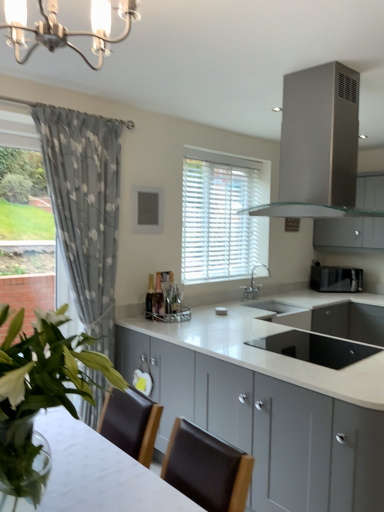
Locate an element on the screen. black matte toaster at right, which is the 1th appliance from back to front is located at coordinates (335, 278).

Locate an element on the screen. Image resolution: width=384 pixels, height=512 pixels. silver metallic faucet at center is located at coordinates (253, 285).

What do you see at coordinates (318, 145) in the screenshot? I see `stainless steel range hood at upper center` at bounding box center [318, 145].

Where is `black matte toaster at right, the second appliance positioned from the left`? This screenshot has height=512, width=384. black matte toaster at right, the second appliance positioned from the left is located at coordinates (335, 278).

From a real-world perspective, is white glossy cabinets at center, which is the 2th cabinetry from top to bottom, above or below brown leather chair at lower center?

white glossy cabinets at center, which is the 2th cabinetry from top to bottom, is situated lower than brown leather chair at lower center in the real world.

Which object is closer to the camera, white glossy cabinets at center, which is the second cabinetry in back-to-front order, or brown leather chair at lower center?

brown leather chair at lower center.

What's the angular difference between white glossy cabinets at center, which is the second cabinetry in back-to-front order, and brown leather chair at lower center's facing directions?

They differ by 177 degrees in their facing directions.

From the picture: Can you confirm if white glossy cabinets at center, which is the second cabinetry in back-to-front order, is thinner than brown leather chair at lower center?

No.

From the image's perspective, who appears lower, white blinds at center or white glossy cabinets at center, which appears as the 2th cabinetry when viewed from the right?

From the image's view, white glossy cabinets at center, which appears as the 2th cabinetry when viewed from the right, is below.

Is white blinds at center oriented towards white glossy cabinets at center, which appears as the 2th cabinetry when viewed from the right?

No.

How different are the orientations of white blinds at center and white glossy cabinets at center, which is the 2th cabinetry from top to bottom, in degrees?

They differ by 90.5 degrees in their facing directions.

From the picture: Is white glossy cabinets at center, which is the second cabinetry in back-to-front order, positioned far away from stainless steel range hood at upper center?

Indeed, white glossy cabinets at center, which is the second cabinetry in back-to-front order, is not near stainless steel range hood at upper center.

Could you tell me if white glossy cabinets at center, which appears as the 2th cabinetry when viewed from the right, is facing stainless steel range hood at upper center?

No, white glossy cabinets at center, which appears as the 2th cabinetry when viewed from the right, does not turn towards stainless steel range hood at upper center.

From the image's perspective, between black matte toaster at right, which is the second appliance in front-to-back order, and green leafy plant at center, which one is located above?

black matte toaster at right, which is the second appliance in front-to-back order, is shown above in the image.

Based on the photo, are black matte toaster at right, the first appliance positioned from the top, and green leafy plant at center making contact?

black matte toaster at right, the first appliance positioned from the top, and green leafy plant at center are not in contact.

From a real-world perspective, between black matte toaster at right, the first appliance positioned from the top, and green leafy plant at center, who is vertically lower?

In real-world perspective, black matte toaster at right, the first appliance positioned from the top, is lower.

Who is bigger, black matte toaster at right, the second appliance positioned from the left, or green leafy plant at center?

green leafy plant at center.

Is metallic chandelier at upper center with green leafy plant at center?

No, metallic chandelier at upper center is not with green leafy plant at center.

Between point (25, 29) and point (49, 353), which one is positioned in front?

The point (25, 29) is more forward.

Image resolution: width=384 pixels, height=512 pixels. I want to click on light fixture to the right of green leafy plant at center, so click(65, 27).

Is metallic chandelier at upper center bigger than green leafy plant at center?

No, metallic chandelier at upper center is not bigger than green leafy plant at center.

Considering the sizes of objects satin silver cabinet at upper right, which is the 1th cabinetry in back-to-front order, and metallic chandelier at upper center in the image provided, who is wider, satin silver cabinet at upper right, which is the 1th cabinetry in back-to-front order, or metallic chandelier at upper center?

With larger width is metallic chandelier at upper center.

Are satin silver cabinet at upper right, the second cabinetry positioned from the left, and metallic chandelier at upper center located far from each other?

satin silver cabinet at upper right, the second cabinetry positioned from the left, is positioned a significant distance from metallic chandelier at upper center.

Which of these two, satin silver cabinet at upper right, the second cabinetry positioned from the left, or metallic chandelier at upper center, is smaller?

Smaller between the two is metallic chandelier at upper center.

Could you tell me if satin silver cabinet at upper right, the 2th cabinetry when ordered from front to back, is turned towards metallic chandelier at upper center?

Yes, satin silver cabinet at upper right, the 2th cabinetry when ordered from front to back, is oriented towards metallic chandelier at upper center.

Considering the relative positions of gray floral fabric curtain at left and black matte toaster at right, which is the 1th appliance from back to front, in the image provided, is gray floral fabric curtain at left to the right of black matte toaster at right, which is the 1th appliance from back to front, from the viewer's perspective?

Incorrect, gray floral fabric curtain at left is not on the right side of black matte toaster at right, which is the 1th appliance from back to front.

Considering the relative positions of gray floral fabric curtain at left and black matte toaster at right, the 2th appliance positioned from the bottom, in the image provided, is gray floral fabric curtain at left behind black matte toaster at right, the 2th appliance positioned from the bottom,?

No, gray floral fabric curtain at left is closer to the viewer.

Is point (66, 240) less distant than point (345, 278)?

Yes.

From the image's perspective, does gray floral fabric curtain at left appear lower than black matte toaster at right, the second appliance positioned from the left?

No, from the image's perspective, gray floral fabric curtain at left is not beneath black matte toaster at right, the second appliance positioned from the left.

At what (x,y) coordinates should I click in order to perform the action: click on chair above the white glossy cabinets at center, which appears as the 2th cabinetry when viewed from the right (from the image's perspective). Please return your answer as a coordinate pair (x, y). Image resolution: width=384 pixels, height=512 pixels. Looking at the image, I should click on (206, 468).

Identify the location of cabinetry in front of the white blinds at center. This screenshot has width=384, height=512. (279, 393).

Looking at this image, from the image, which object appears to be nearer to black glass sink at center, the second appliance in the top-to-bottom sequence, black matte toaster at right, the 2th appliance positioned from the bottom, or white blinds at center?

white blinds at center is positioned closer to the anchor black glass sink at center, the second appliance in the top-to-bottom sequence.

Based on their spatial positions, is gray floral fabric curtain at left or black glass sink at center, placed as the second appliance when sorted from back to front, closer to green leafy plant at center?

black glass sink at center, placed as the second appliance when sorted from back to front, is positioned closer to the anchor green leafy plant at center.

From the image, which object appears to be farther from silver metallic faucet at center, satin silver cabinet at upper right, the second cabinetry positioned from the left, or metallic chandelier at upper center?

Among the two, metallic chandelier at upper center is located further to silver metallic faucet at center.

Estimate the real-world distances between objects in this image. Which object is closer to metallic chandelier at upper center, green leafy plant at center or white glossy cabinets at center, which appears as the 2th cabinetry when viewed from the right?

The object closer to metallic chandelier at upper center is green leafy plant at center.

Based on their spatial positions, is black matte toaster at right, which is the second appliance in front-to-back order, or white glossy cabinets at center, which is the second cabinetry in back-to-front order, closer to metallic chandelier at upper center?

white glossy cabinets at center, which is the second cabinetry in back-to-front order.

From the image, which object appears to be nearer to green leafy plant at center, brown leather chair at lower center or satin silver cabinet at upper right, placed as the first cabinetry when sorted from top to bottom?

Among the two, brown leather chair at lower center is located nearer to green leafy plant at center.

Looking at the image, which one is located closer to metallic chandelier at upper center, black glass sink at center, placed as the second appliance when sorted from back to front, or silver metallic faucet at center?

The object closer to metallic chandelier at upper center is black glass sink at center, placed as the second appliance when sorted from back to front.

Which object lies nearer to the anchor point white blinds at center, metallic chandelier at upper center or black glass sink at center, placed as the second appliance when sorted from back to front?

black glass sink at center, placed as the second appliance when sorted from back to front, is closer to white blinds at center.

In order to click on curtain between brown leather chair at lower center and white blinds at center from front to back in this screenshot , I will do `click(85, 209)`.

Find the location of a particular element. houseplant between metallic chandelier at upper center and stainless steel range hood at upper center from front to back is located at coordinates (40, 392).

Find the location of a particular element. Image resolution: width=384 pixels, height=512 pixels. tap between green leafy plant at center and black matte toaster at right, marked as the 1th appliance in a right-to-left arrangement, in the front-back direction is located at coordinates (253, 285).

I want to click on houseplant between metallic chandelier at upper center and silver metallic faucet at center from front to back, so click(40, 392).